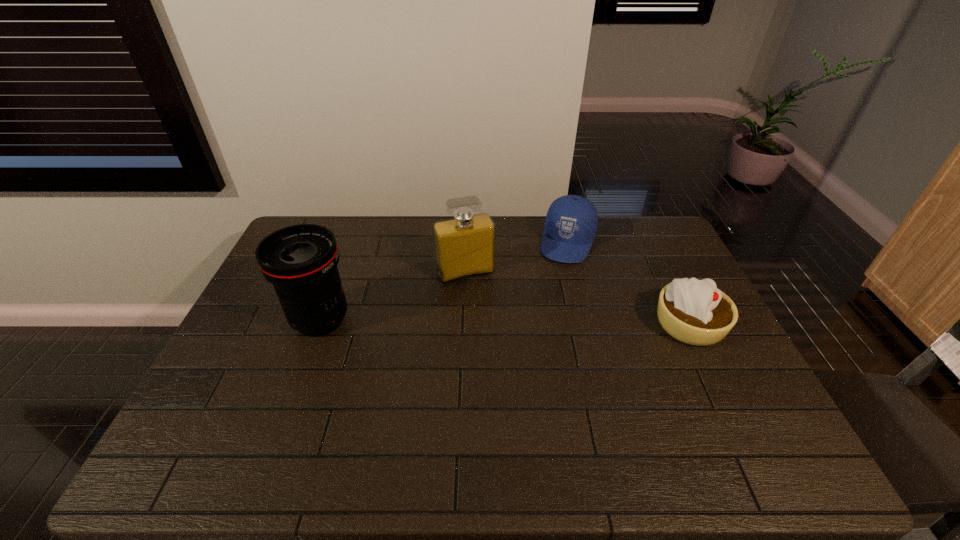
Identify the location of the closest object to the second object from right to left. (465, 245).

You are a GUI agent. You are given a task and a screenshot of the screen. Output one action in this format:
    pyautogui.click(x=<x>, y=<y>)
    Task: Click on the blank space that satisfies the following two spatial constraints: 1. on the front side of the whipped cream; 2. on the left side of the perfume
    
    Given the screenshot: What is the action you would take?
    pyautogui.click(x=464, y=325)

You are a GUI agent. You are given a task and a screenshot of the screen. Output one action in this format:
    pyautogui.click(x=<x>, y=<y>)
    Task: Click on the free spot that satisfies the following two spatial constraints: 1. on the back side of the second object from left to right; 2. on the right side of the cap
    The height and width of the screenshot is (540, 960).
    Given the screenshot: What is the action you would take?
    click(467, 242)

The image size is (960, 540). I want to click on free space that satisfies the following two spatial constraints: 1. on the back side of the cap; 2. on the right side of the third object from right to left, so click(467, 242).